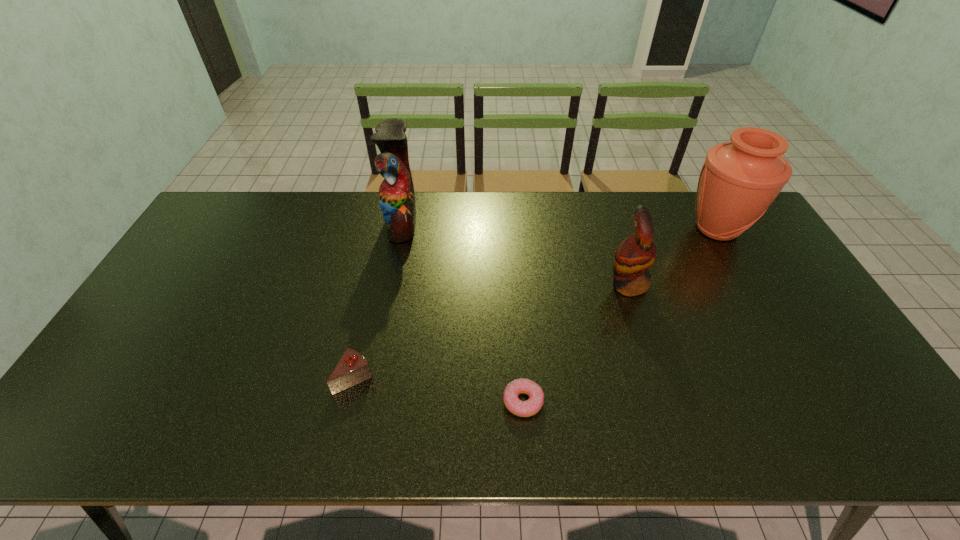
Find the location of a particular element. The height and width of the screenshot is (540, 960). vacant space at the far edge of the desktop is located at coordinates (565, 215).

Locate an element on the screen. Image resolution: width=960 pixels, height=540 pixels. vacant space at the near edge is located at coordinates (595, 438).

Image resolution: width=960 pixels, height=540 pixels. What are the coordinates of `vacant space at the left edge of the desktop` in the screenshot? It's located at (207, 243).

What are the coordinates of `free space at the right edge of the desktop` in the screenshot? It's located at (867, 410).

Where is `empty space that is in between the taller parrot and the rightmost object`? empty space that is in between the taller parrot and the rightmost object is located at coordinates (560, 225).

Where is `free space between the left parrot and the third object from left to right`? This screenshot has width=960, height=540. free space between the left parrot and the third object from left to right is located at coordinates (463, 312).

Locate an element on the screen. The image size is (960, 540). empty location between the doughnut and the farther parrot is located at coordinates (463, 312).

At what (x,y) coordinates should I click in order to perform the action: click on free spot between the second shortest object and the shortest object. Please return your answer as a coordinate pair (x, y). Image resolution: width=960 pixels, height=540 pixels. Looking at the image, I should click on click(439, 389).

The height and width of the screenshot is (540, 960). I want to click on vacant area that lies between the doughnut and the second shortest object, so point(439,389).

The image size is (960, 540). What are the coordinates of `free space between the chocolate cake and the vase` in the screenshot? It's located at (536, 303).